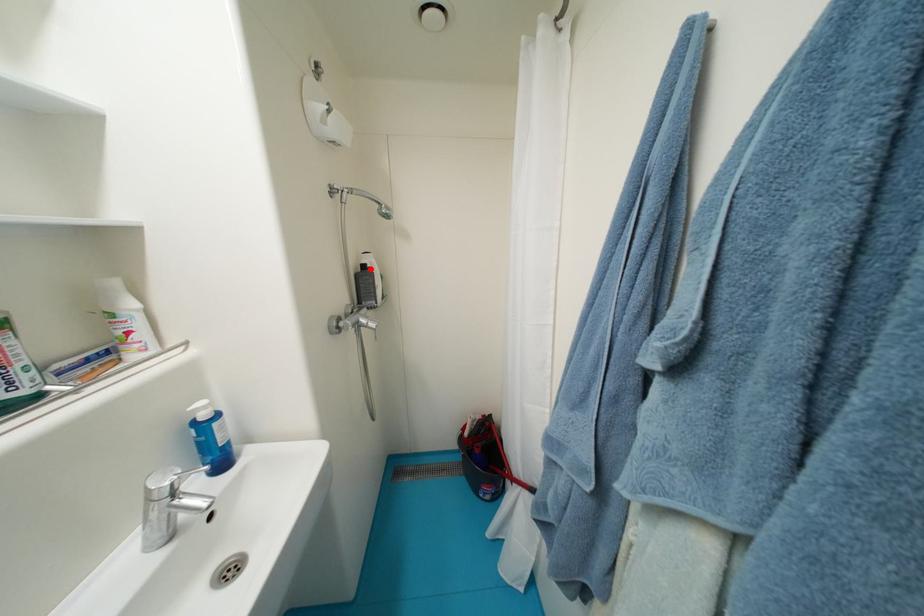
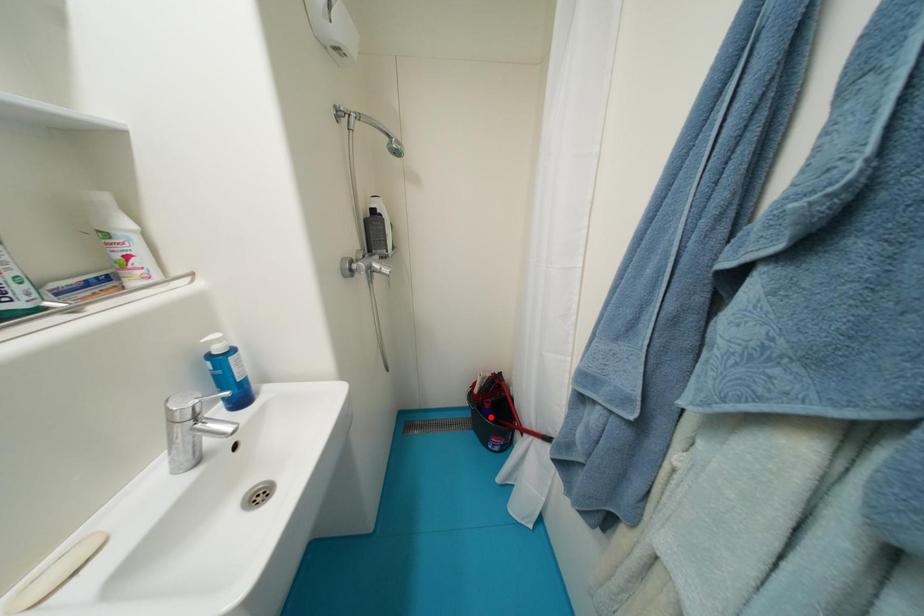
I am providing you with two images of the same scene from different viewpoints. A red point is marked on the first image and another point is marked on the second image. Are the points marked in image1 and image2 representing the same 3D position?

No